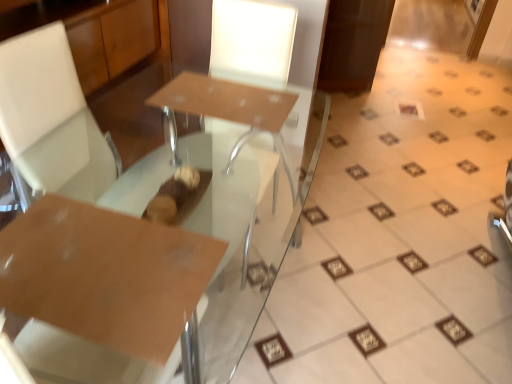
You are a GUI agent. You are given a task and a screenshot of the screen. Output one action in this format:
    pyautogui.click(x=<x>, y=<y>)
    Task: Click on the free spot above glossy brown table at center (from a real-world perspective)
    The image size is (512, 384).
    Given the screenshot: What is the action you would take?
    pyautogui.click(x=89, y=260)